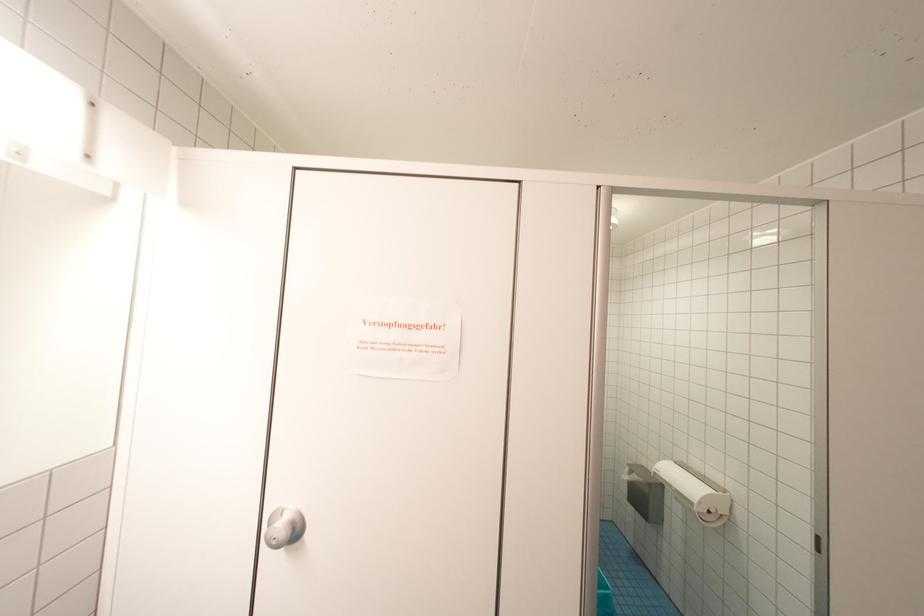
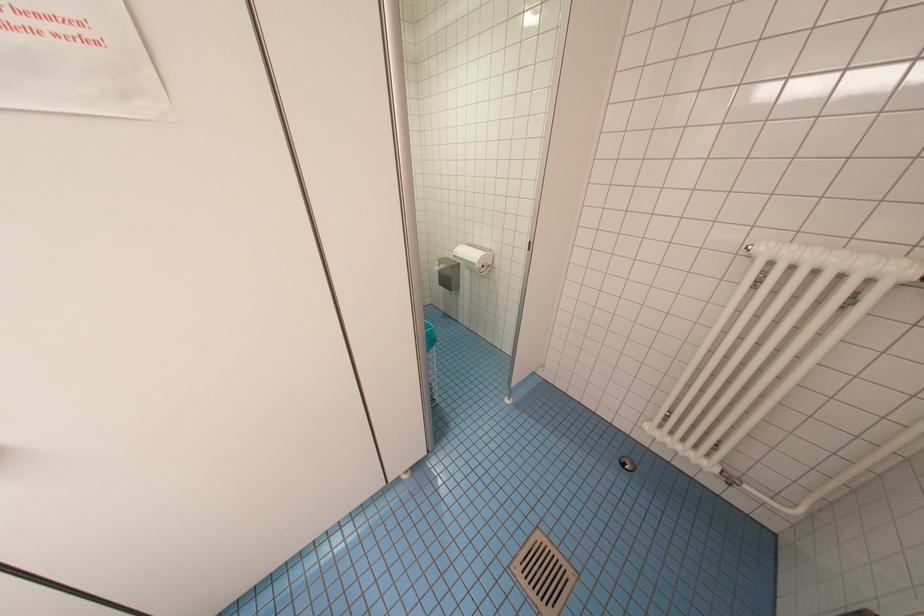
The images are taken continuously from a first-person perspective. In which direction is your viewpoint rotating?

The camera's rotation is toward right-down.